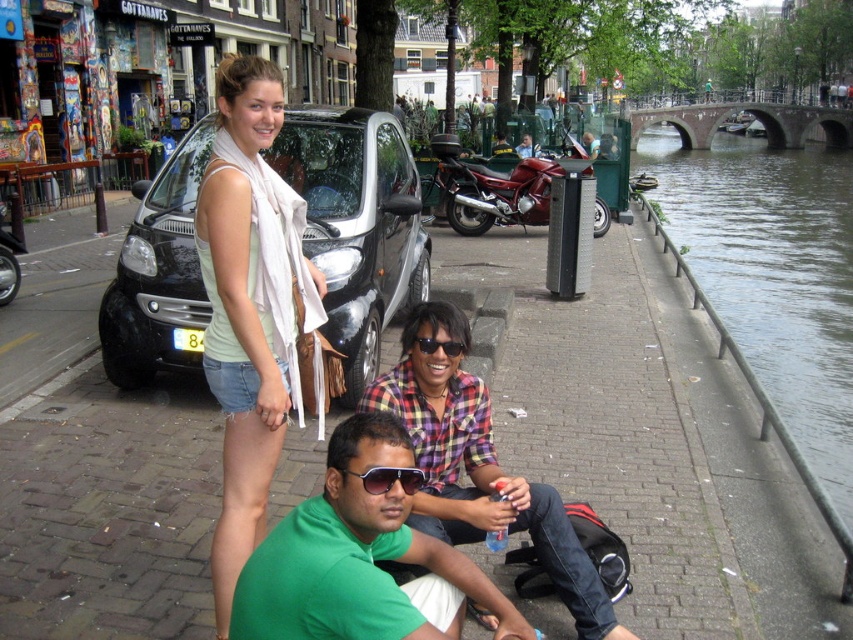
Is greenish water at right taller than sunglasses at center?

Yes.

Measure the distance between greenish water at right and sunglasses at center.

greenish water at right and sunglasses at center are 68.44 feet apart.

Does point (834, 467) lie behind point (378, 467)?

Yes, it is.

This screenshot has height=640, width=853. In order to click on greenish water at right in this screenshot , I will do `click(773, 275)`.

Can you confirm if sunglasses at center is taller than black plastic sunglasses at center?

Indeed, sunglasses at center has a greater height compared to black plastic sunglasses at center.

Which is behind, point (370, 477) or point (415, 342)?

Positioned behind is point (415, 342).

You are a GUI agent. You are given a task and a screenshot of the screen. Output one action in this format:
    pyautogui.click(x=<x>, y=<y>)
    Task: Click on the sunglasses at center
    This screenshot has height=640, width=853.
    Given the screenshot: What is the action you would take?
    pyautogui.click(x=389, y=477)

Who is positioned more to the right, light green fabric scarf at upper center or black plastic sunglasses at center?

black plastic sunglasses at center

Which is behind, point (223, 259) or point (445, 342)?

The point (445, 342) is more distant.

Find the location of a particular element. The height and width of the screenshot is (640, 853). light green fabric scarf at upper center is located at coordinates (250, 305).